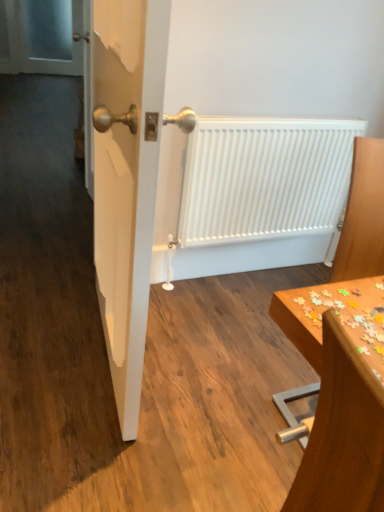
This screenshot has width=384, height=512. Find the location of `vacant space that is in between white glossy door at center and wooden table at right`. vacant space that is in between white glossy door at center and wooden table at right is located at coordinates (216, 373).